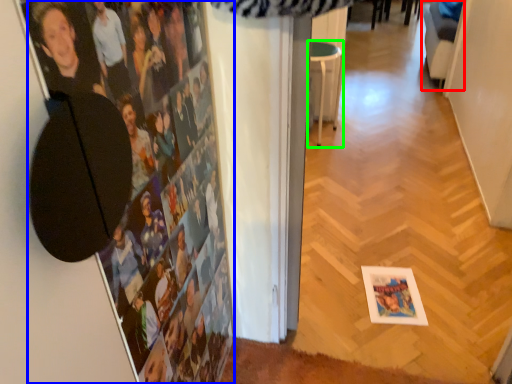
Question: Which is farther away from swivel chair (highlighted by a red box)? person (highlighted by a blue box) or furniture (highlighted by a green box)?

Choices:
 (A) person
 (B) furniture

Answer: (A)